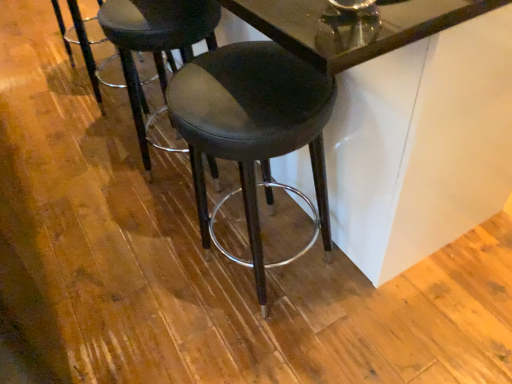
Question: Is matte black stool at center, which is counted as the 1th stool, starting from the left, in front of or behind black leather stool at center, which is the second stool from left to right, in the image?

Choices:
 (A) front
 (B) behind

Answer: (B)

Question: In terms of height, does matte black stool at center, which is counted as the 1th stool, starting from the left, look taller or shorter compared to black leather stool at center, which is the second stool from left to right?

Choices:
 (A) short
 (B) tall

Answer: (A)

Question: Which of these objects is positioned farthest from the black leather stool at center, which is the second stool from left to right?

Choices:
 (A) glossy glass table at center
 (B) matte black stool at center, which is counted as the 1th stool, starting from the left
 (C) black leather stool at center

Answer: (C)

Question: Estimate the real-world distances between objects in this image. Which object is farther from the glossy glass table at center?

Choices:
 (A) black leather stool at center
 (B) black leather stool at center, which is the second stool from left to right
 (C) matte black stool at center, which is counted as the 1th stool, starting from the left

Answer: (A)